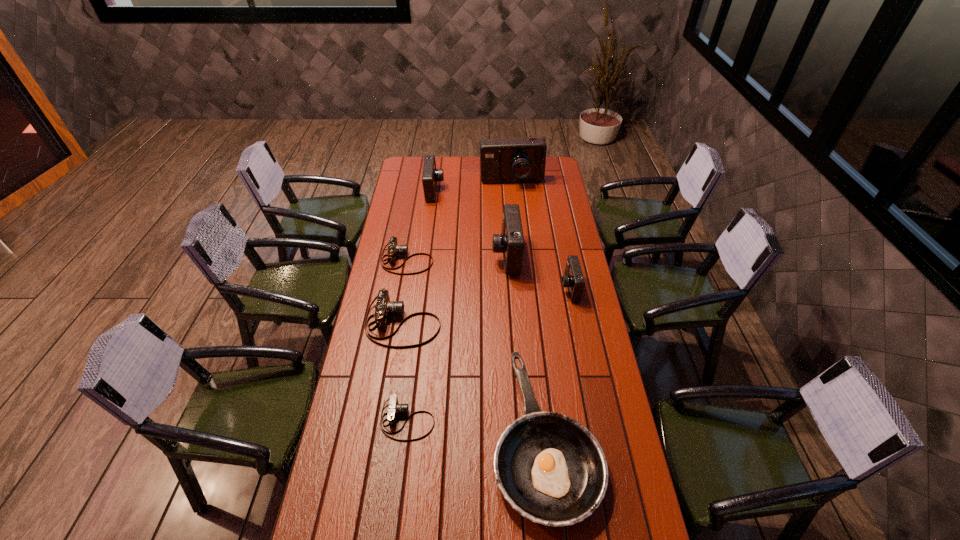
Identify the location of the second smallest brown camera. (394, 249).

Identify the location of the farthest brown camera. The height and width of the screenshot is (540, 960). (394, 249).

At what (x,y) coordinates should I click in order to perform the action: click on red frying pan. Please return your answer as a coordinate pair (x, y). Looking at the image, I should click on (550, 468).

Locate an element on the screen. This screenshot has height=540, width=960. the nearest brown camera is located at coordinates (394, 408).

Find the location of a particular element. the nearest camera is located at coordinates (394, 408).

You are a GUI agent. You are given a task and a screenshot of the screen. Output one action in this format:
    pyautogui.click(x=<x>, y=<y>)
    Task: Click on the vacant space located on the front-facing side of the tallest camera
    
    Given the screenshot: What is the action you would take?
    pyautogui.click(x=516, y=227)

Locate an element on the screen. free region located on the front-facing side of the second biggest blue camera is located at coordinates (434, 255).

Locate an element on the screen. The image size is (960, 540). vacant area located on the front-facing side of the second biggest blue camera is located at coordinates (444, 255).

What are the coordinates of `free location located 0.210m on the front-facing side of the second biggest blue camera` in the screenshot? It's located at [446, 255].

Find the location of a particular element. vacant space located 0.180m on the front-facing side of the leftmost blue camera is located at coordinates (477, 191).